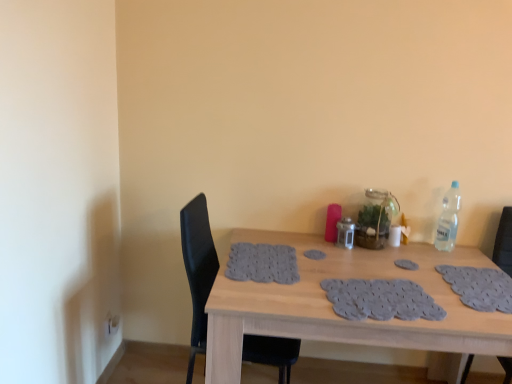
I want to click on vacant space in front of gray fabric placemat at center, placed as the first footprint when sorted from bottom to top, so click(x=424, y=282).